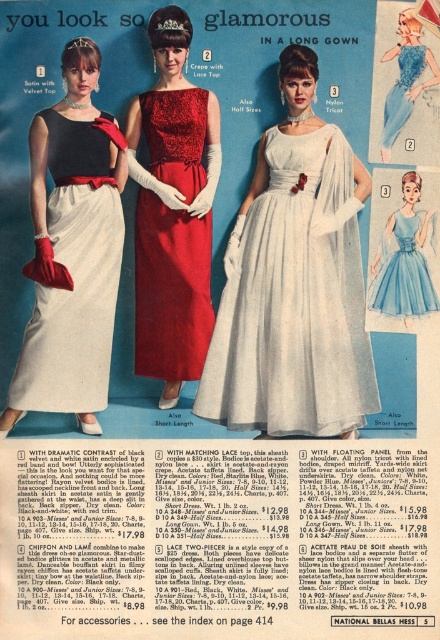
Is point (201, 406) positioned before point (84, 100)?

No.

Describe the element at coordinates (294, 282) in the screenshot. The image size is (440, 640). I see `white nylon dress at center` at that location.

Based on the photo, who is more forward, [311,368] or [121,216]?

Point [311,368] is more forward.

Where is `white nylon dress at center`? white nylon dress at center is located at coordinates click(294, 282).

Between point (52, 252) and point (396, 88), which one is positioned behind?

The point (52, 252) is behind.

Is matte black velvet top at left positioned at the back of matte nylon dress at center?

Yes, it is behind matte nylon dress at center.

You are a GUI agent. You are given a task and a screenshot of the screen. Output one action in this format:
    pyautogui.click(x=<x>, y=<y>)
    Task: Click on the matte black velvet top at left
    The height and width of the screenshot is (640, 440).
    Given the screenshot: What is the action you would take?
    pyautogui.click(x=73, y=250)

Between matte black velvet top at left and light blue satin dress at center, which one has more height?

Standing taller between the two is matte black velvet top at left.

Does matte black velvet top at left have a greater height compared to light blue satin dress at center?

Indeed, matte black velvet top at left has a greater height compared to light blue satin dress at center.

Does point (7, 394) come farther from viewer compared to point (411, 268)?

No, (7, 394) is closer to viewer.

Find the location of `matte black velvet top at left`. matte black velvet top at left is located at coordinates (73, 250).